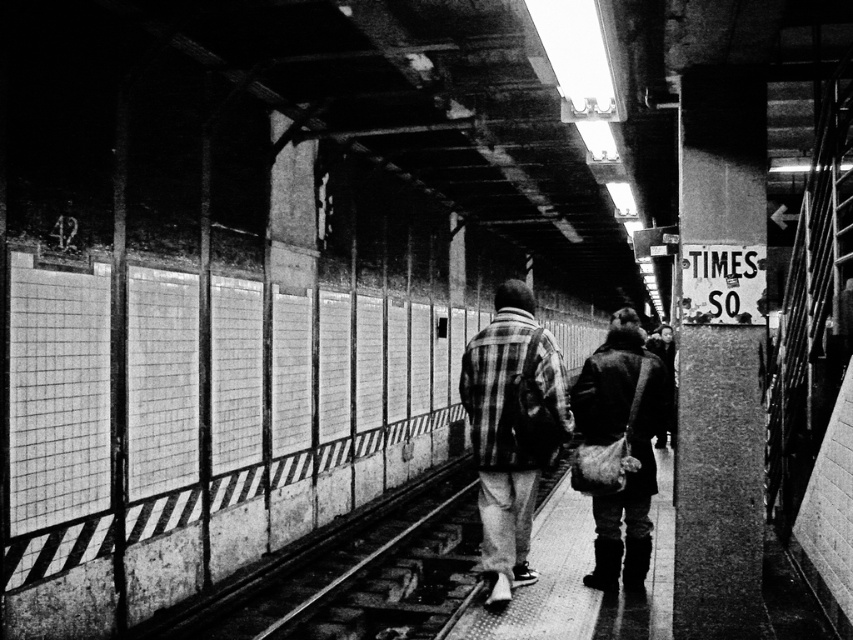
Question: Which of the following is the closest to the observer?

Choices:
 (A) plaid fabric jacket at center
 (B) leather bag at center

Answer: (A)

Question: Can you confirm if plaid fabric jacket at center is thinner than leather bag at center?

Choices:
 (A) no
 (B) yes

Answer: (B)

Question: Can you confirm if plaid fabric jacket at center is positioned to the left of leather bag at center?

Choices:
 (A) no
 (B) yes

Answer: (B)

Question: Which of the following is the closest to the observer?

Choices:
 (A) plaid fabric jacket at center
 (B) leather bag at center

Answer: (A)

Question: Does plaid fabric jacket at center have a smaller size compared to leather bag at center?

Choices:
 (A) yes
 (B) no

Answer: (A)

Question: Which object is closer to the camera taking this photo?

Choices:
 (A) leather bag at center
 (B) plaid fabric jacket at center

Answer: (B)